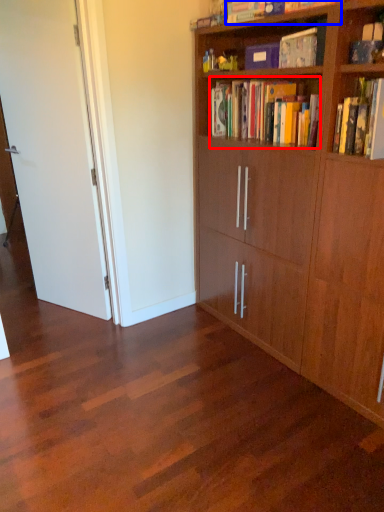
Question: Which object appears farthest to the camera in this image, book (highlighted by a red box) or book (highlighted by a blue box)?

Choices:
 (A) book
 (B) book

Answer: (B)